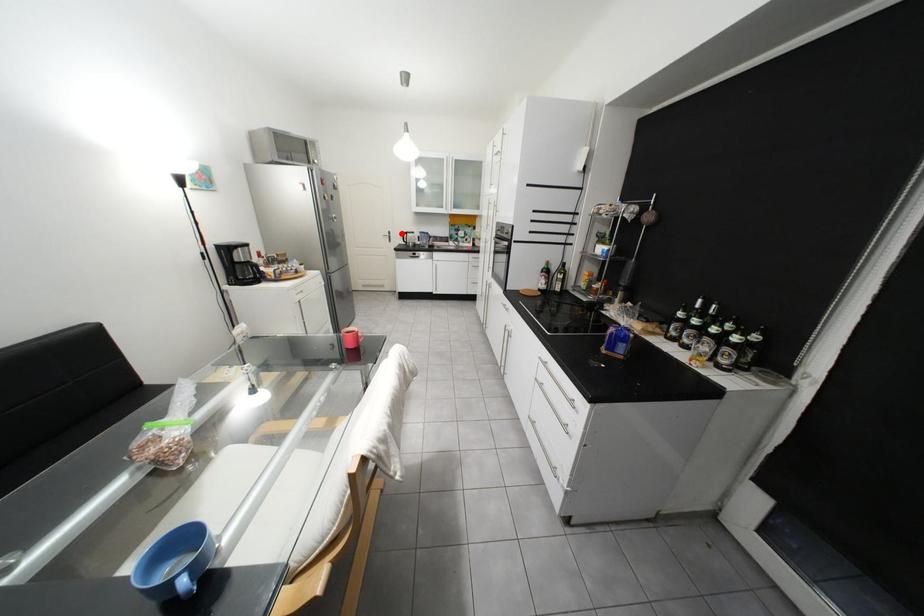
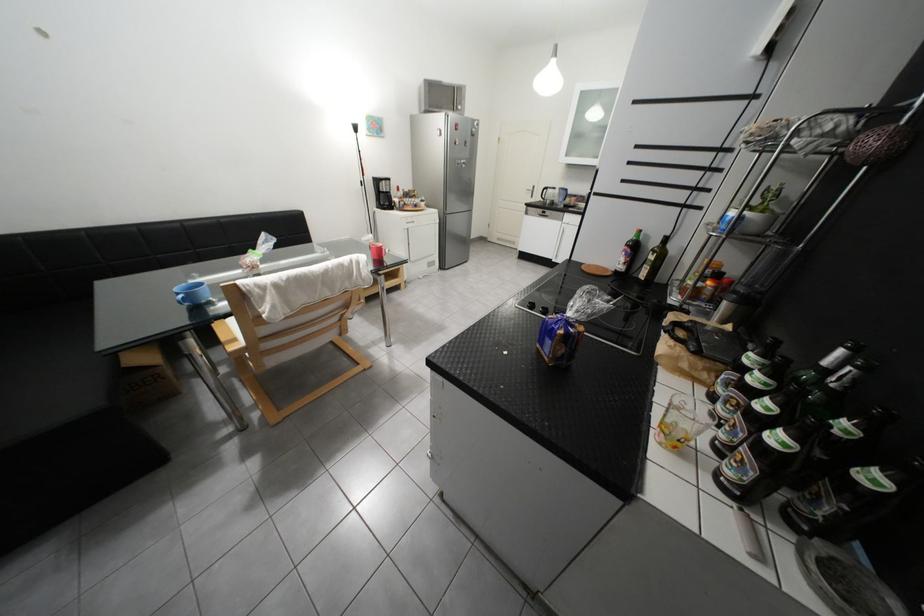
Where in the second image is the point corresponding to the highlighted location from the first image?

(545, 188)